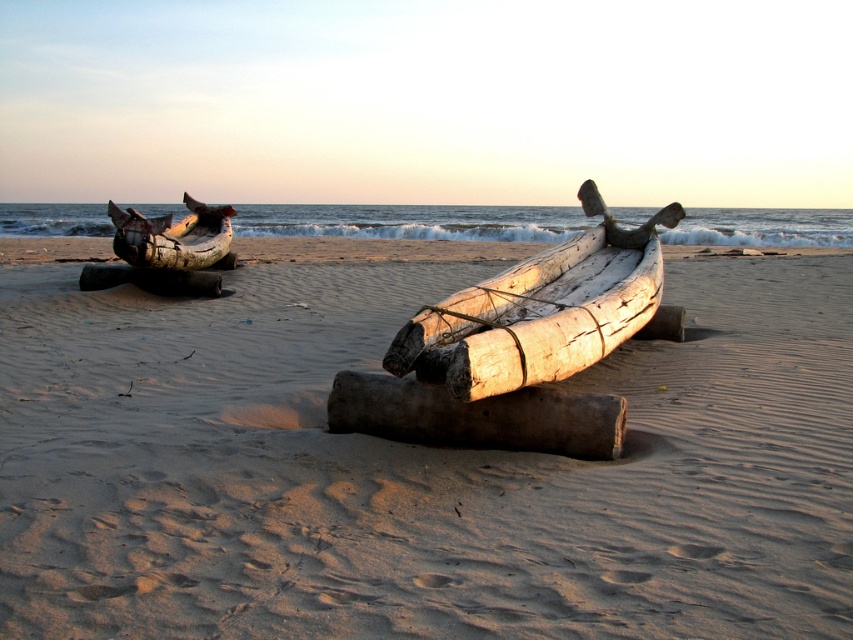
You are a beachcomber searching for items on the beach. You have a small metal detector that can scan an area of 1 meter in diameter. You notice the smooth sand at center and the light brown wooden boat at center. Which location would you prioritize scanning with your metal detector?

The smooth sand at center has a larger size compared to the light brown wooden boat at center, so you should prioritize scanning the smooth sand at center because it covers a bigger area and might have more items buried there.

You are standing on the beach and want to place a small flag between the dark brown wood log at center and the rusty metal canoe at left. Which object should the flag be closer to if you want it to appear farther away from you?

The flag should be placed closer to the rusty metal canoe at left because it is farther away from the viewer compared to the dark brown wood log at center.

You are standing at the point labeled point (404, 356) on the beach. You want to walk to the point labeled point (795, 420). Which direction should you face to walk directly towards your destination?

You should face towards the direction of the horizon where the sun is setting or rising since point (795, 420) is behind point (404, 356), meaning it is further away from the viewer in the image. However, without additional spatial context, it is challenging to determine the exact direction. Alternatively, based on the coordinate system, moving from point (404, 356) to point (795, 420) would involve moving right and upwards in the image frame.